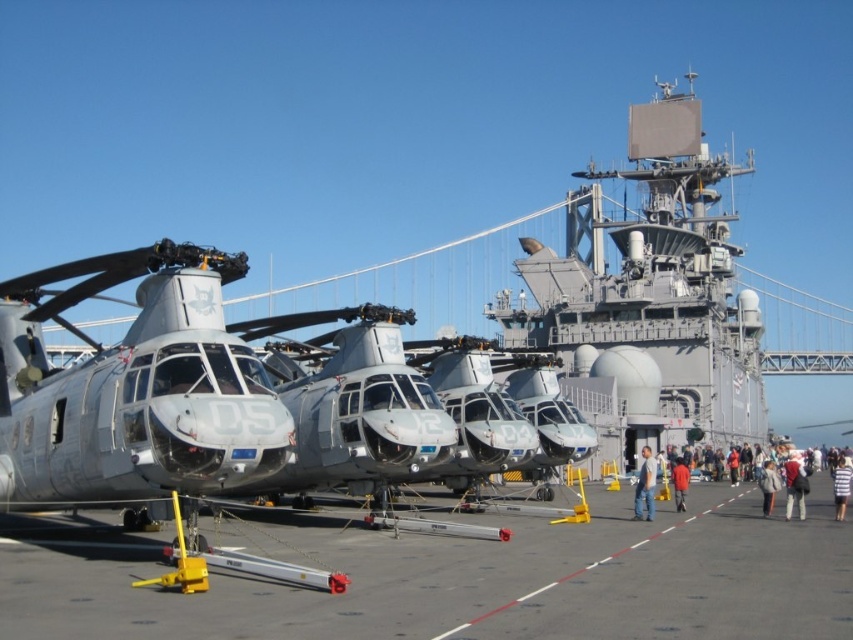
Which is behind, point (119, 600) or point (761, 506)?

The point (761, 506) is more distant.

From the picture: How far apart are smooth gray tarmac at center and white cotton jacket at lower right?

22.25 meters

Identify the location of smooth gray tarmac at center. (456, 579).

What are the coordinates of `smooth gray tarmac at center` in the screenshot? It's located at (456, 579).

Between light blue jeans at lower right and striped shirt at lower right, which one has more height?

With more height is light blue jeans at lower right.

Based on the photo, can you confirm if light blue jeans at lower right is positioned above striped shirt at lower right?

Yes, light blue jeans at lower right is above striped shirt at lower right.

Does point (840, 499) lie in front of point (838, 515)?

Yes, it is in front of point (838, 515).

Locate an element on the screen. This screenshot has width=853, height=640. light blue jeans at lower right is located at coordinates (680, 481).

Does light blue jeans at lower right lie in front of red fabric jacket at lower right?

Yes, it is in front of red fabric jacket at lower right.

Is light blue jeans at lower right below red fabric jacket at lower right?

Indeed, light blue jeans at lower right is positioned under red fabric jacket at lower right.

Which is behind, point (764, 467) or point (677, 493)?

Positioned behind is point (764, 467).

Locate an element on the screen. light blue jeans at lower right is located at coordinates (680, 481).